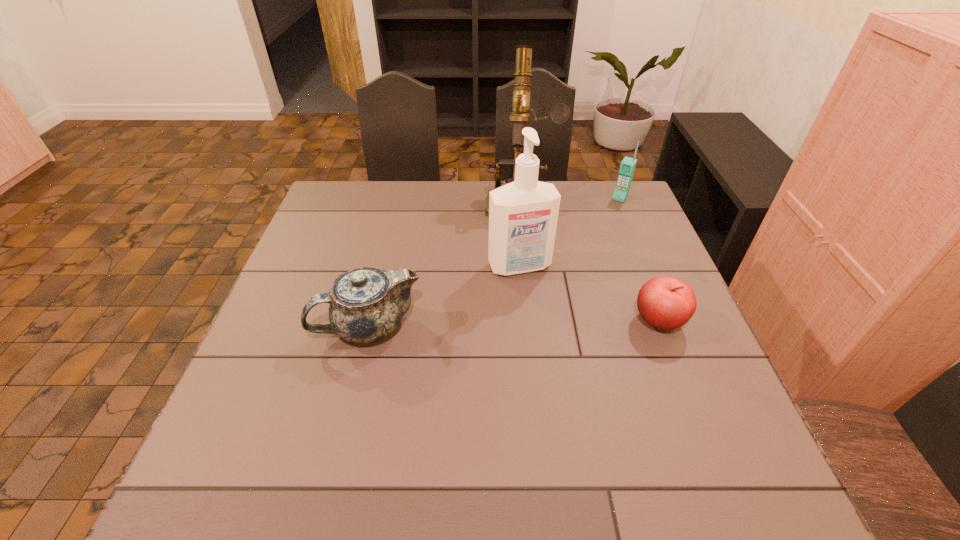
You are a GUI agent. You are given a task and a screenshot of the screen. Output one action in this format:
    pyautogui.click(x=<x>, y=<y>)
    Task: Click on the free space on the desktop that is between the second shortest object and the apple and is positioned on the front label of the cleansing agent
    Image resolution: width=960 pixels, height=540 pixels.
    Given the screenshot: What is the action you would take?
    pyautogui.click(x=545, y=323)

Find the location of `vacant space on the desktop that is between the second shortest object and the apple and is positioned at the eyepiece of the microscope`. vacant space on the desktop that is between the second shortest object and the apple and is positioned at the eyepiece of the microscope is located at coordinates (516, 323).

Where is `free space on the desktop that is between the chinaware and the shortest object and is positioned on the keypad of the cellular telephone`? The height and width of the screenshot is (540, 960). free space on the desktop that is between the chinaware and the shortest object and is positioned on the keypad of the cellular telephone is located at coordinates (543, 323).